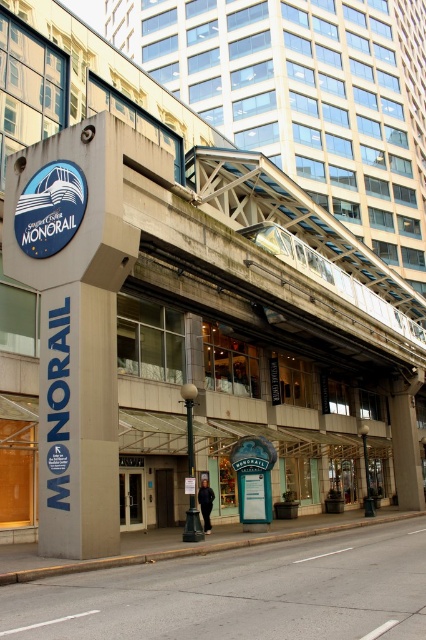
Question: Can you confirm if gray concrete sign at left is bigger than blue glossy monorail sign at upper left?

Choices:
 (A) yes
 (B) no

Answer: (A)

Question: Which point is farther to the camera?

Choices:
 (A) (54, 220)
 (B) (34, 278)

Answer: (B)

Question: In this image, where is gray concrete sign at left located relative to blue glossy monorail sign at upper left?

Choices:
 (A) above
 (B) below

Answer: (B)

Question: Among these objects, which one is nearest to the camera?

Choices:
 (A) blue glossy monorail sign at upper left
 (B) gray concrete sign at left

Answer: (B)

Question: Does gray concrete sign at left have a greater width compared to blue glossy monorail sign at upper left?

Choices:
 (A) yes
 (B) no

Answer: (A)

Question: Among these points, which one is farthest from the camera?

Choices:
 (A) (62, 177)
 (B) (91, 557)

Answer: (A)